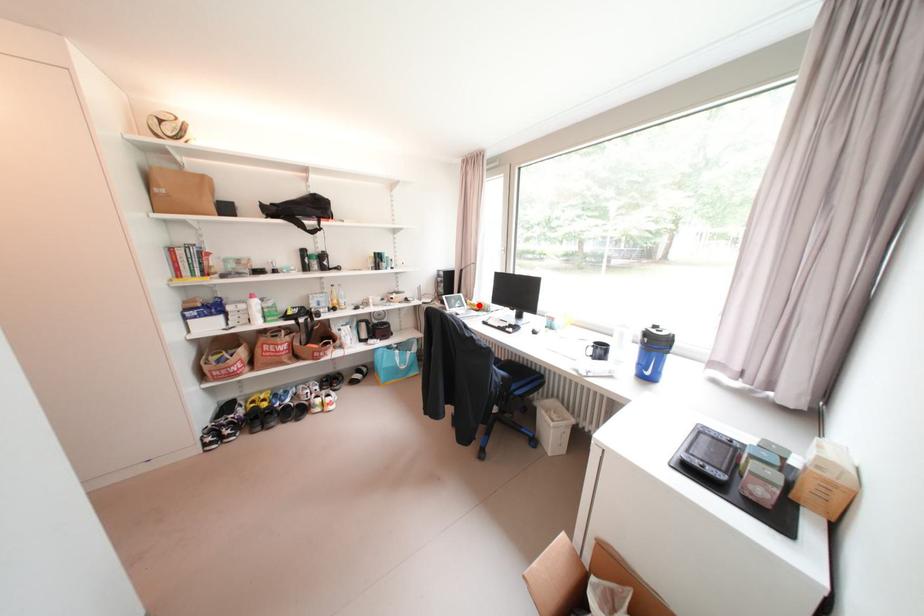
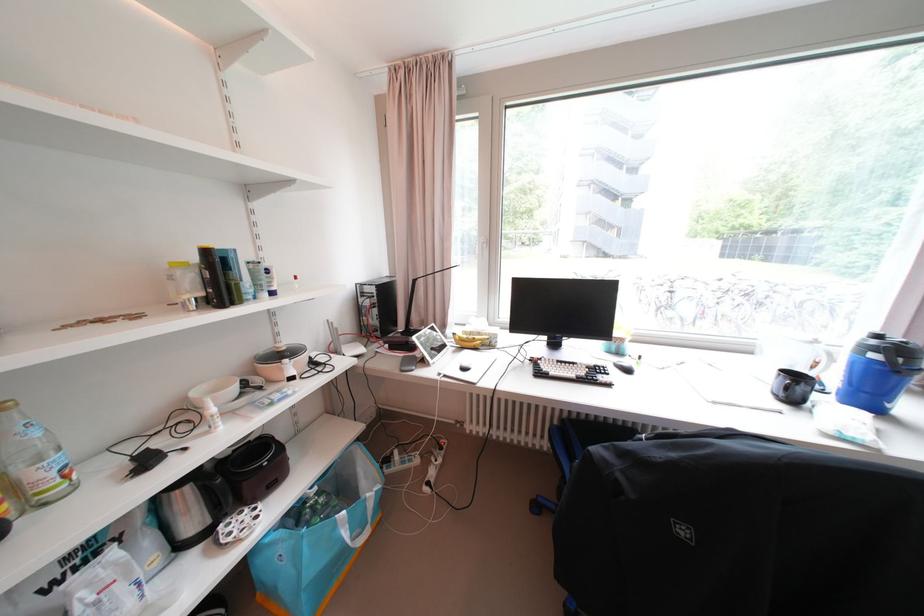
The point at the highlighted location is marked in the first image. Where is the corresponding point in the second image?

(468, 341)